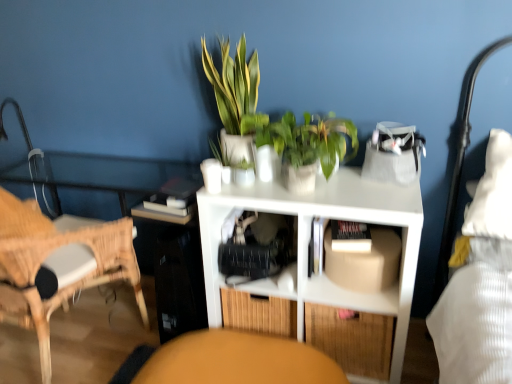
From the picture: What is the approximate width of translucent plastic shelf at center, the second shelf positioned from the bottom?

translucent plastic shelf at center, the second shelf positioned from the bottom, is 46.23 centimeters wide.

Describe the element at coordinates (320, 246) in the screenshot. I see `white matte shelf at center, positioned as the first shelf in bottom-to-top order` at that location.

The width and height of the screenshot is (512, 384). Identify the location of translucent plastic shelf at center, the 1th shelf viewed from the top. (262, 254).

From the image's perspective, is beige cardboard box at center under green leafy plant at upper center, the 1th houseplant in the left-to-right sequence?

Yes, from the image's perspective, beige cardboard box at center is below green leafy plant at upper center, the 1th houseplant in the left-to-right sequence.

Is beige cardboard box at center placed right next to green leafy plant at upper center, marked as the 2th houseplant in a right-to-left arrangement?

There is a gap between beige cardboard box at center and green leafy plant at upper center, marked as the 2th houseplant in a right-to-left arrangement.

Is beige cardboard box at center wider than green leafy plant at upper center, marked as the 2th houseplant in a right-to-left arrangement?

Yes.

Does beige cardboard box at center have a smaller size compared to green leafy plant at upper center, the 1th houseplant in the left-to-right sequence?

Correct, beige cardboard box at center occupies less space than green leafy plant at upper center, the 1th houseplant in the left-to-right sequence.

Is woven wood chair at left bigger than green glossy plant at center, the first houseplant in the right-to-left sequence?

Yes.

From a real-world perspective, relative to green glossy plant at center, the first houseplant in the right-to-left sequence, is woven wood chair at left vertically above or below?

Clearly, from a real-world perspective, woven wood chair at left is below green glossy plant at center, the first houseplant in the right-to-left sequence.

How far apart are woven wood chair at left and green glossy plant at center, the first houseplant in the right-to-left sequence?

A distance of 32.57 inches exists between woven wood chair at left and green glossy plant at center, the first houseplant in the right-to-left sequence.

From the image's perspective, is bamboo drawer at lower center above or below white matte book at center?

bamboo drawer at lower center is situated lower than white matte book at center in the image.

Is bamboo drawer at lower center with white matte book at center?

bamboo drawer at lower center and white matte book at center are clearly separated.

Based on the photo, is bamboo drawer at lower center taller or shorter than white matte book at center?

bamboo drawer at lower center is taller than white matte book at center.

In the scene shown: Which is more to the left, bamboo drawer at lower center or white matte book at center?

From the viewer's perspective, white matte book at center appears more on the left side.

From a real-world perspective, is bamboo drawer at lower center physically located above or below woven wood chair at left?

In terms of real-world spatial position, bamboo drawer at lower center is below woven wood chair at left.

Between bamboo drawer at lower center and woven wood chair at left, which one has larger size?

woven wood chair at left is bigger.

Considering the sizes of objects bamboo drawer at lower center and woven wood chair at left in the image provided, who is taller, bamboo drawer at lower center or woven wood chair at left?

woven wood chair at left is taller.

Image resolution: width=512 pixels, height=384 pixels. Identify the location of the 2nd shelf in front of the beige cardboard box at center, counting from the anchor's position. (320, 246).

Relative to beige cardboard box at center, is white matte shelf at center, the 2th shelf positioned from the top, in front or behind?

Clearly, white matte shelf at center, the 2th shelf positioned from the top, is in front of beige cardboard box at center.

Is white matte shelf at center, the 2th shelf positioned from the top, far away from beige cardboard box at center?

No, white matte shelf at center, the 2th shelf positioned from the top, is not far away from beige cardboard box at center.

From a real-world perspective, is white matte shelf at center, positioned as the first shelf in bottom-to-top order, on top of beige cardboard box at center?

No.

From the image's perspective, which object appears higher, green glossy plant at center, the first houseplant in the right-to-left sequence, or translucent plastic shelf at center, the second shelf positioned from the bottom?

green glossy plant at center, the first houseplant in the right-to-left sequence, appears higher in the image.

In the scene shown: Is green glossy plant at center, the first houseplant in the right-to-left sequence, not inside translucent plastic shelf at center, the 1th shelf viewed from the top?

green glossy plant at center, the first houseplant in the right-to-left sequence, lies outside translucent plastic shelf at center, the 1th shelf viewed from the top,'s area.

Is green glossy plant at center, acting as the 2th houseplant starting from the left, next to translucent plastic shelf at center, the 1th shelf viewed from the top?

They are not placed beside each other.

Is green glossy plant at center, the first houseplant in the right-to-left sequence, closer to camera compared to translucent plastic shelf at center, the second shelf positioned from the bottom?

Yes, it is in front of translucent plastic shelf at center, the second shelf positioned from the bottom.

The width and height of the screenshot is (512, 384). Identify the location of the 2nd shelf below the green glossy plant at center, the first houseplant in the right-to-left sequence (from a real-world perspective). (320, 246).

Considering the positions of point (298, 296) and point (330, 134), is point (298, 296) closer or farther from the camera than point (330, 134)?

Point (298, 296) is farther from the camera than point (330, 134).

From the image's perspective, between white matte shelf at center, positioned as the first shelf in bottom-to-top order, and green glossy plant at center, the first houseplant in the right-to-left sequence, who is located below?

white matte shelf at center, positioned as the first shelf in bottom-to-top order, appears lower in the image.

Is white matte shelf at center, the 2th shelf positioned from the top, to the left or to the right of green glossy plant at center, acting as the 2th houseplant starting from the left, in the image?

Clearly, white matte shelf at center, the 2th shelf positioned from the top, is on the left of green glossy plant at center, acting as the 2th houseplant starting from the left, in the image.

I want to click on cabinet that is below the green leafy plant at upper center, marked as the 2th houseplant in a right-to-left arrangement (from the image's perspective), so click(x=360, y=276).

Locate an element on the screen. houseplant that is the 1st one when counting backward from the woven wood chair at left is located at coordinates (303, 144).

Estimate the real-world distances between objects in this image. Which object is further from white matte book at center, green glossy plant at center, acting as the 2th houseplant starting from the left, or woven wood chair at left?

Among the two, woven wood chair at left is located further to white matte book at center.

Estimate the real-world distances between objects in this image. Which object is further from white matte shelf at center, the 2th shelf positioned from the top, matte orange swivel chair at lower center or green glossy plant at center, acting as the 2th houseplant starting from the left?

Answer: matte orange swivel chair at lower center.

Considering their positions, is green leafy plant at upper center, the 1th houseplant in the left-to-right sequence, positioned closer to matte orange swivel chair at lower center than translucent plastic shelf at center, the 1th shelf viewed from the top?

Among the two, translucent plastic shelf at center, the 1th shelf viewed from the top, is located nearer to matte orange swivel chair at lower center.

When comparing their distances from woven wood chair at left, does matte orange swivel chair at lower center or translucent plastic shelf at center, the 1th shelf viewed from the top, seem further?

The object further to woven wood chair at left is translucent plastic shelf at center, the 1th shelf viewed from the top.

Looking at the image, which one is located closer to green glossy plant at center, the first houseplant in the right-to-left sequence, translucent plastic shelf at center, the 1th shelf viewed from the top, or green leafy plant at upper center, the 1th houseplant in the left-to-right sequence?

Based on the image, green leafy plant at upper center, the 1th houseplant in the left-to-right sequence, appears to be nearer to green glossy plant at center, the first houseplant in the right-to-left sequence.

Based on their spatial positions, is matte orange swivel chair at lower center or green glossy plant at center, acting as the 2th houseplant starting from the left, further from woven wood chair at left?

green glossy plant at center, acting as the 2th houseplant starting from the left, is further to woven wood chair at left.

Based on their spatial positions, is matte orange swivel chair at lower center or white matte book at center closer to green glossy plant at center, acting as the 2th houseplant starting from the left?

The object closer to green glossy plant at center, acting as the 2th houseplant starting from the left, is white matte book at center.

Looking at the image, which one is located closer to green glossy plant at center, the first houseplant in the right-to-left sequence, white matte shelf at center, the 2th shelf positioned from the top, or bamboo drawer at lower center?

Among the two, white matte shelf at center, the 2th shelf positioned from the top, is located nearer to green glossy plant at center, the first houseplant in the right-to-left sequence.

What are the coordinates of `drawer between white matte book at center and matte orange swivel chair at lower center from top to bottom` in the screenshot? It's located at (352, 339).

At what (x,y) coordinates should I click in order to perform the action: click on chair between green leafy plant at upper center, the 1th houseplant in the left-to-right sequence, and matte orange swivel chair at lower center, in the vertical direction. Please return your answer as a coordinate pair (x, y). Looking at the image, I should click on (58, 264).

Locate an element on the screen. The image size is (512, 384). book between green glossy plant at center, the first houseplant in the right-to-left sequence, and white matte shelf at center, positioned as the first shelf in bottom-to-top order, from top to bottom is located at coordinates (350, 236).

The height and width of the screenshot is (384, 512). In order to click on shelf between translucent plastic shelf at center, the 1th shelf viewed from the top, and bamboo drawer at lower center in this screenshot , I will do `click(320, 246)`.